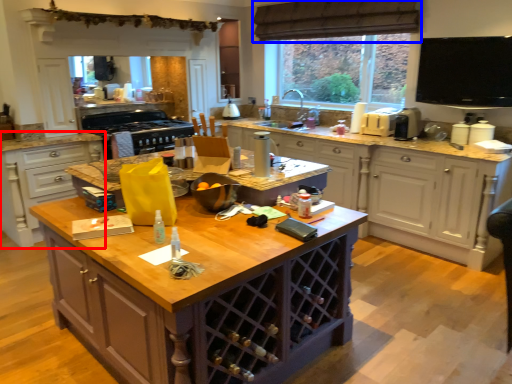
Question: Which point is further to the camera, cabinetry (highlighted by a red box) or curtain (highlighted by a blue box)?

Choices:
 (A) cabinetry
 (B) curtain

Answer: (B)